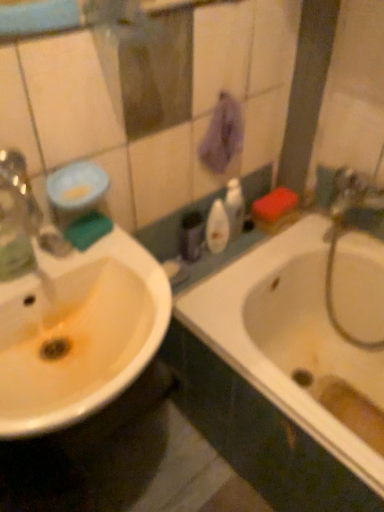
The width and height of the screenshot is (384, 512). What do you see at coordinates (217, 228) in the screenshot? I see `translucent plastic mouthwash at center, acting as the second mouthwash starting from the front` at bounding box center [217, 228].

This screenshot has width=384, height=512. Describe the element at coordinates (234, 208) in the screenshot. I see `white glossy bottle at center, the 2th toiletry from the left` at that location.

Locate an element on the screen. Image resolution: width=384 pixels, height=512 pixels. white glossy bottle at center, the 2th toiletry from the left is located at coordinates (234, 208).

Describe the element at coordinates (222, 135) in the screenshot. This screenshot has height=512, width=384. I see `purple fabric hand towel at upper center` at that location.

Describe the element at coordinates (71, 319) in the screenshot. Image resolution: width=384 pixels, height=512 pixels. I see `white glossy sink at left` at that location.

This screenshot has height=512, width=384. I want to click on translucent plastic mouthwash at center, marked as the 1th mouthwash in a right-to-left arrangement, so click(x=217, y=228).

From a real-world perspective, is white glossy sink at left below white glossy bottle at center, the 2th toiletry from the left?

Incorrect, from a real-world perspective, white glossy sink at left is higher than white glossy bottle at center, the 2th toiletry from the left.

From the picture: Is white glossy sink at left facing away from white glossy bottle at center, marked as the first toiletry in a right-to-left arrangement?

white glossy sink at left does not have its back to white glossy bottle at center, marked as the first toiletry in a right-to-left arrangement.

In the image, is white glossy sink at left on the left side or the right side of white glossy bottle at center, marked as the first toiletry in a right-to-left arrangement?

In the image, white glossy sink at left appears on the left side of white glossy bottle at center, marked as the first toiletry in a right-to-left arrangement.

From a real-world perspective, which toiletry is the 1st one underneath the white glossy sink at left? Please provide its 2D coordinates.

[(234, 208)]

Is matte purple container at center, the first toiletry from the left, smaller than translucent plastic mouthwash at center, which appears as the 1th mouthwash when viewed from the back?

Yes.

Does matte purple container at center, arranged as the 2th toiletry when viewed from the right, have a lesser width compared to translucent plastic mouthwash at center, marked as the second mouthwash in a left-to-right arrangement?

Indeed, matte purple container at center, arranged as the 2th toiletry when viewed from the right, has a lesser width compared to translucent plastic mouthwash at center, marked as the second mouthwash in a left-to-right arrangement.

Does matte purple container at center, arranged as the 2th toiletry when viewed from the right, turn towards translucent plastic mouthwash at center, marked as the 1th mouthwash in a right-to-left arrangement?

No, matte purple container at center, arranged as the 2th toiletry when viewed from the right, is not facing towards translucent plastic mouthwash at center, marked as the 1th mouthwash in a right-to-left arrangement.

How different are the orientations of matte purple container at center, arranged as the 2th toiletry when viewed from the right, and translucent plastic mouthwash at center, marked as the 1th mouthwash in a right-to-left arrangement, in degrees?

They differ by 5.79e-06 degrees in their facing directions.

The image size is (384, 512). In order to click on the 1st toiletry behind the green sponge at left, placed as the first mouthwash when sorted from left to right in this screenshot , I will do `click(191, 236)`.

Can you confirm if matte purple container at center, the first toiletry from the left, is taller than green sponge at left, placed as the first mouthwash when sorted from left to right?

Correct, matte purple container at center, the first toiletry from the left, is much taller as green sponge at left, placed as the first mouthwash when sorted from left to right.

Is matte purple container at center, arranged as the 2th toiletry when viewed from the right, facing away from green sponge at left, acting as the 1th mouthwash starting from the front?

No, matte purple container at center, arranged as the 2th toiletry when viewed from the right, is not facing away from green sponge at left, acting as the 1th mouthwash starting from the front.

Measure the distance from matte purple container at center, the first toiletry from the left, to green sponge at left, positioned as the 2th mouthwash in right-to-left order.

15.20 inches.

Looking at this image, considering the sizes of objects purple fabric hand towel at upper center and green sponge at left, placed as the first mouthwash when sorted from left to right, in the image provided, who is wider, purple fabric hand towel at upper center or green sponge at left, placed as the first mouthwash when sorted from left to right,?

Answer: green sponge at left, placed as the first mouthwash when sorted from left to right, is wider.

Considering the positions of point (225, 169) and point (69, 190), is point (225, 169) closer or farther from the camera than point (69, 190)?

Point (225, 169) appears to be farther away from the viewer than point (69, 190).

From the image's perspective, which is below, purple fabric hand towel at upper center or green sponge at left, placed as the first mouthwash when sorted from left to right?

green sponge at left, placed as the first mouthwash when sorted from left to right, is shown below in the image.

Could you tell me if purple fabric hand towel at upper center is facing green sponge at left, positioned as the 2th mouthwash in right-to-left order?

No, purple fabric hand towel at upper center is not aimed at green sponge at left, positioned as the 2th mouthwash in right-to-left order.

From the image's perspective, is translucent plastic mouthwash at center, marked as the second mouthwash in a left-to-right arrangement, on green sponge at left?

Yes, from the image's perspective, translucent plastic mouthwash at center, marked as the second mouthwash in a left-to-right arrangement, is above green sponge at left.

Is translucent plastic mouthwash at center, which appears as the 1th mouthwash when viewed from the back, oriented away from green sponge at left?

translucent plastic mouthwash at center, which appears as the 1th mouthwash when viewed from the back, is not turned away from green sponge at left.

Which point is more forward, (228, 228) or (82, 231)?

The point (82, 231) is in front.

Relative to green sponge at left, is translucent plastic mouthwash at center, marked as the second mouthwash in a left-to-right arrangement, in front or behind?

Clearly, translucent plastic mouthwash at center, marked as the second mouthwash in a left-to-right arrangement, is behind green sponge at left.

Image resolution: width=384 pixels, height=512 pixels. Find the location of `sink above the translucent plastic mouthwash at center, marked as the second mouthwash in a left-to-right arrangement (from a real-world perspective)`. sink above the translucent plastic mouthwash at center, marked as the second mouthwash in a left-to-right arrangement (from a real-world perspective) is located at coordinates (71, 319).

From a real-world perspective, which object stands above the other?

white glossy sink at left, from a real-world perspective.

Considering the positions of objects translucent plastic mouthwash at center, which appears as the 1th mouthwash when viewed from the back, and white glossy sink at left in the image provided, who is more to the right, translucent plastic mouthwash at center, which appears as the 1th mouthwash when viewed from the back, or white glossy sink at left?

From the viewer's perspective, translucent plastic mouthwash at center, which appears as the 1th mouthwash when viewed from the back, appears more on the right side.

Between translucent plastic mouthwash at center, acting as the second mouthwash starting from the front, and white glossy sink at left, which one is positioned in front?

white glossy sink at left is more forward.

From a real-world perspective, which is physically below, purple fabric hand towel at upper center or translucent plastic mouthwash at center, marked as the second mouthwash in a left-to-right arrangement?

From a 3D spatial view, translucent plastic mouthwash at center, marked as the second mouthwash in a left-to-right arrangement, is below.

Can you confirm if purple fabric hand towel at upper center is positioned to the left of translucent plastic mouthwash at center, acting as the second mouthwash starting from the front?

No, purple fabric hand towel at upper center is not to the left of translucent plastic mouthwash at center, acting as the second mouthwash starting from the front.

Which object is thinner, purple fabric hand towel at upper center or translucent plastic mouthwash at center, acting as the second mouthwash starting from the front?

Thinner between the two is purple fabric hand towel at upper center.

From a real-world perspective, starting from the white glossy sink at left, which toiletry is the 1st one below it? Please provide its 2D coordinates.

[(234, 208)]

From the image's perspective, which mouthwash is the 1st one above the matte purple container at center, the first toiletry from the left? Please provide its 2D coordinates.

[(217, 228)]

Estimate the real-world distances between objects in this image. Which object is further from matte purple container at center, the first toiletry from the left, purple fabric hand towel at upper center or translucent plastic mouthwash at center, which appears as the 1th mouthwash when viewed from the back?

purple fabric hand towel at upper center.

Which object lies nearer to the anchor point white glossy bottle at center, marked as the first toiletry in a right-to-left arrangement, purple fabric hand towel at upper center or green sponge at left?

purple fabric hand towel at upper center is closer to white glossy bottle at center, marked as the first toiletry in a right-to-left arrangement.

When comparing their distances from white glossy bottle at center, the 2th toiletry from the left, does translucent plastic mouthwash at center, marked as the 1th mouthwash in a right-to-left arrangement, or white glossy sink at left seem closer?

translucent plastic mouthwash at center, marked as the 1th mouthwash in a right-to-left arrangement, is closer to white glossy bottle at center, the 2th toiletry from the left.

Looking at the image, which one is located further to white glossy sink at left, purple fabric hand towel at upper center or white glossy bottle at center, the 2th toiletry from the left?

Among the two, white glossy bottle at center, the 2th toiletry from the left, is located further to white glossy sink at left.

Based on their spatial positions, is white glossy bathtub at right or white glossy sink at left further from matte purple container at center, the first toiletry from the left?

white glossy sink at left is positioned further to the anchor matte purple container at center, the first toiletry from the left.

Estimate the real-world distances between objects in this image. Which object is closer to green sponge at left, white glossy bottle at center, marked as the first toiletry in a right-to-left arrangement, or matte purple container at center, the first toiletry from the left?

matte purple container at center, the first toiletry from the left, is closer to green sponge at left.

From the image, which object appears to be nearer to white glossy sink at left, matte purple container at center, arranged as the 2th toiletry when viewed from the right, or translucent plastic mouthwash at center, marked as the 1th mouthwash in a right-to-left arrangement?

The object closer to white glossy sink at left is matte purple container at center, arranged as the 2th toiletry when viewed from the right.

From the image, which object appears to be nearer to matte purple container at center, the first toiletry from the left, green sponge at left or white glossy bathtub at right?

green sponge at left lies closer to matte purple container at center, the first toiletry from the left, than the other object.

What are the coordinates of `toiletry located between green sponge at left, placed as the first mouthwash when sorted from left to right, and translucent plastic mouthwash at center, marked as the second mouthwash in a left-to-right arrangement, in the depth direction` in the screenshot? It's located at (191, 236).

In order to click on toiletry between green sponge at left and white glossy bottle at center, marked as the first toiletry in a right-to-left arrangement, in the front-back direction in this screenshot , I will do `click(191, 236)`.

Where is `mouthwash between white glossy sink at left and translucent plastic mouthwash at center, which appears as the 1th mouthwash when viewed from the back, from front to back`? The image size is (384, 512). mouthwash between white glossy sink at left and translucent plastic mouthwash at center, which appears as the 1th mouthwash when viewed from the back, from front to back is located at coordinates (79, 202).

Find the location of a particular element. The width and height of the screenshot is (384, 512). hand towel between white glossy sink at left and white glossy bathtub at right is located at coordinates (222, 135).